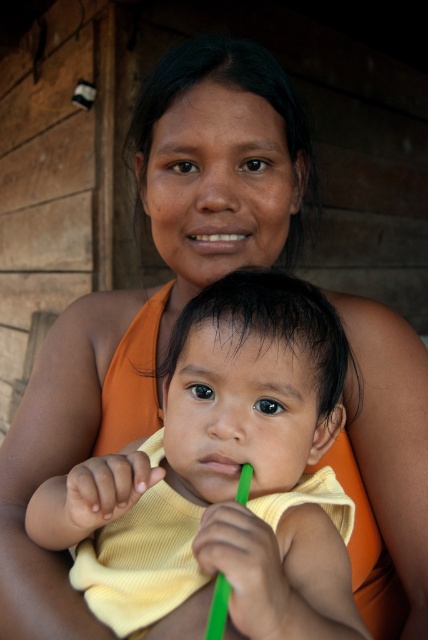
Question: Is yellow fabric baby at center thinner than matte skin at center?

Choices:
 (A) no
 (B) yes

Answer: (A)

Question: Which point is closer to the camera?

Choices:
 (A) green plastic toothbrush at lower center
 (B) matte skin at center
 (C) yellow fabric baby at center

Answer: (C)

Question: Which point is closer to the camera taking this photo?

Choices:
 (A) (219, 461)
 (B) (323, 624)
 (C) (187, 234)

Answer: (B)

Question: Observing the image, what is the correct spatial positioning of yellow fabric baby at center in reference to green plastic toothbrush at lower center?

Choices:
 (A) left
 (B) right

Answer: (A)

Question: Which object is closer to the camera taking this photo?

Choices:
 (A) green plastic toothbrush at lower center
 (B) matte skin at center

Answer: (A)

Question: Can you confirm if yellow fabric baby at center is smaller than matte skin at center?

Choices:
 (A) no
 (B) yes

Answer: (A)